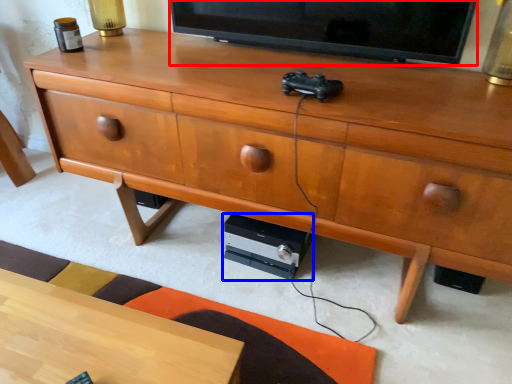
Question: Which point is further to the camera, television (highlighted by a red box) or stereo (highlighted by a blue box)?

Choices:
 (A) television
 (B) stereo

Answer: (B)